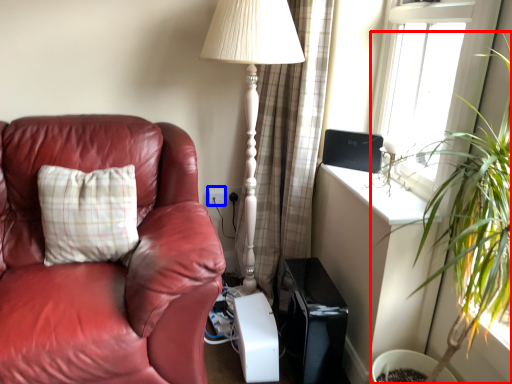
Question: Among these objects, which one is nearest to the camera, houseplant (highlighted by a red box) or electric outlet (highlighted by a blue box)?

Choices:
 (A) houseplant
 (B) electric outlet

Answer: (A)